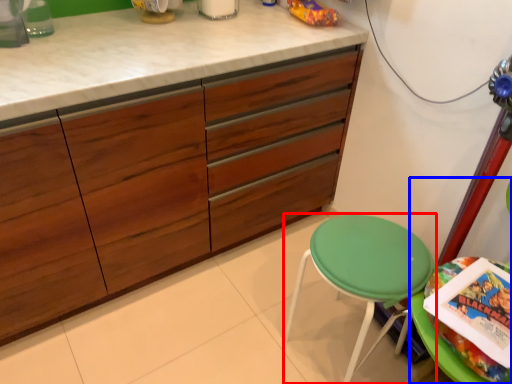
Question: Which of the following is the farthest to the observer, stool (highlighted by a red box) or swivel chair (highlighted by a blue box)?

Choices:
 (A) stool
 (B) swivel chair

Answer: (A)